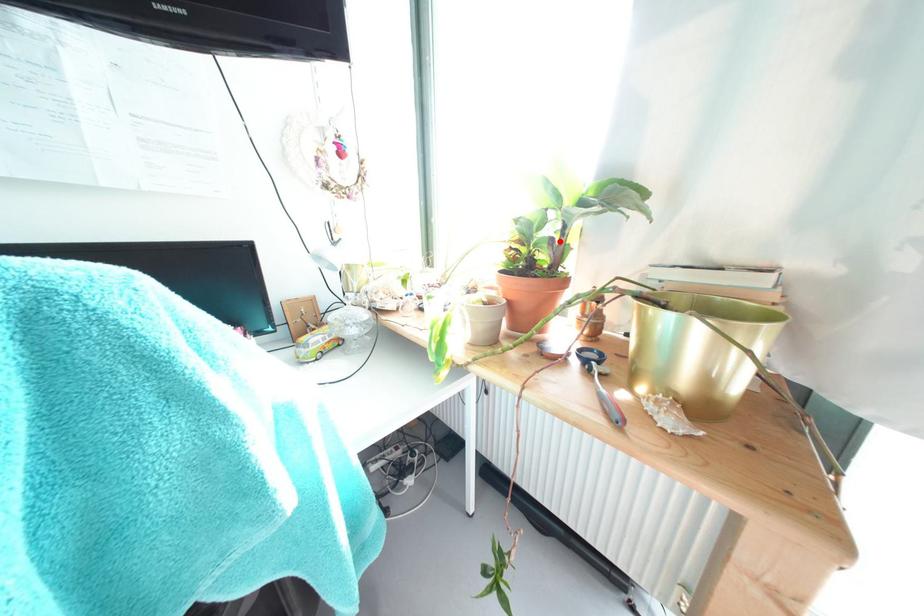
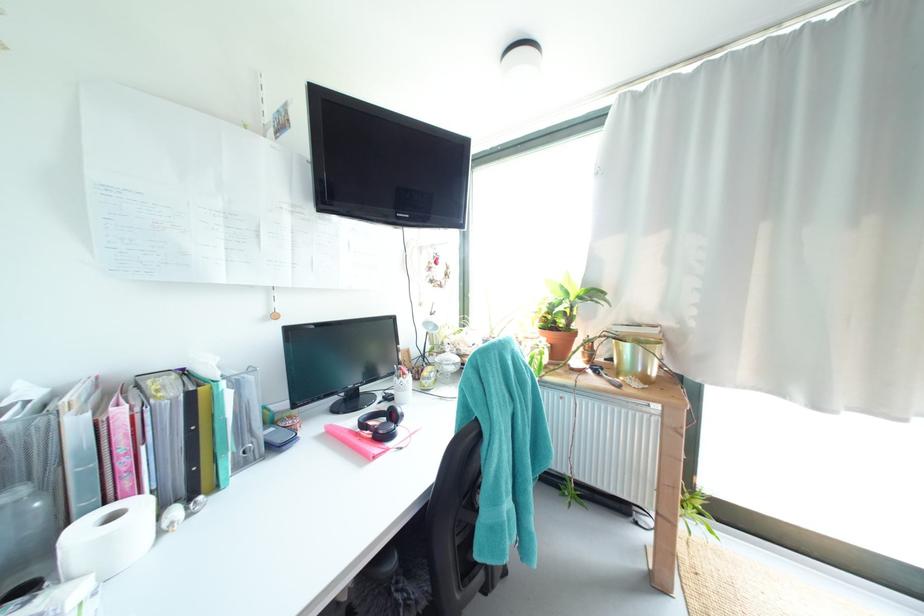
Find the pixel in the second image that matches the highlighted location in the first image.

(573, 315)